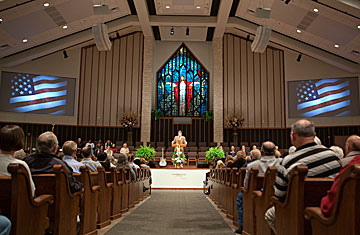
At what (x,y) coordinates should I click in order to perform the action: click on large tan wall panels. Please return your answer as a coordinate pair (x, y). The image size is (360, 235). Looking at the image, I should click on (113, 93), (256, 91).